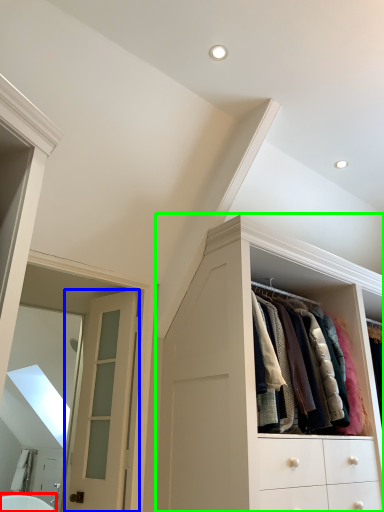
Question: Considering the real-world distances, which object is closest to bath (highlighted by a red box)? door (highlighted by a blue box) or cabinetry (highlighted by a green box).

Choices:
 (A) door
 (B) cabinetry

Answer: (A)